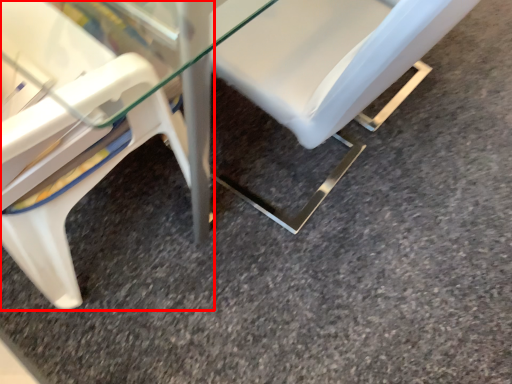
Question: From the image's perspective, where is chair (annotated by the red box) located in relation to chair in the image?

Choices:
 (A) above
 (B) below

Answer: (B)